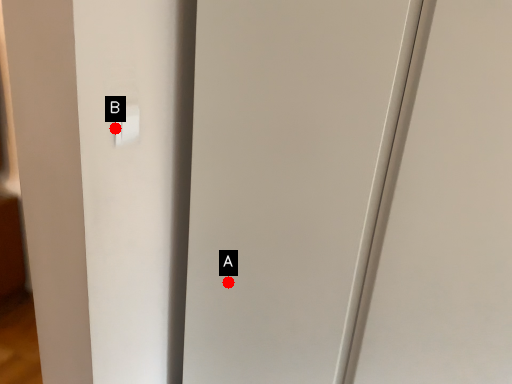
Question: Two points are circled on the image, labeled by A and B beside each circle. Which of the following is the closest to the observer?

Choices:
 (A) A is closer
 (B) B is closer

Answer: (B)